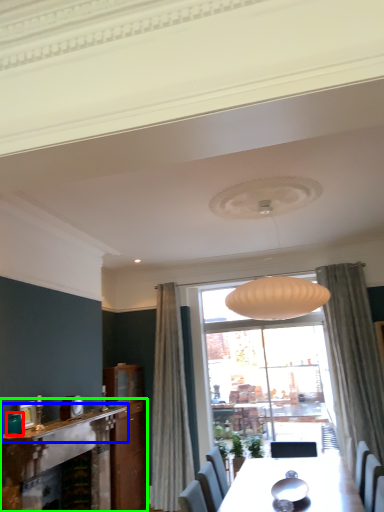
Question: Which object is positioned closest to teal (highlighted by a red box)? Select from mantle (highlighted by a blue box) and fireplace (highlighted by a green box).

Choices:
 (A) mantle
 (B) fireplace

Answer: (A)